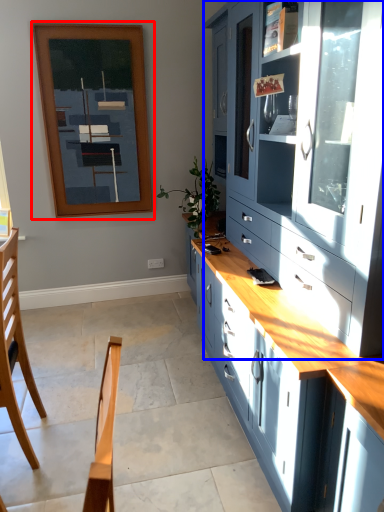
Question: Which object appears closest to the camera in this image, picture frame (highlighted by a red box) or cabinetry (highlighted by a blue box)?

Choices:
 (A) picture frame
 (B) cabinetry

Answer: (B)